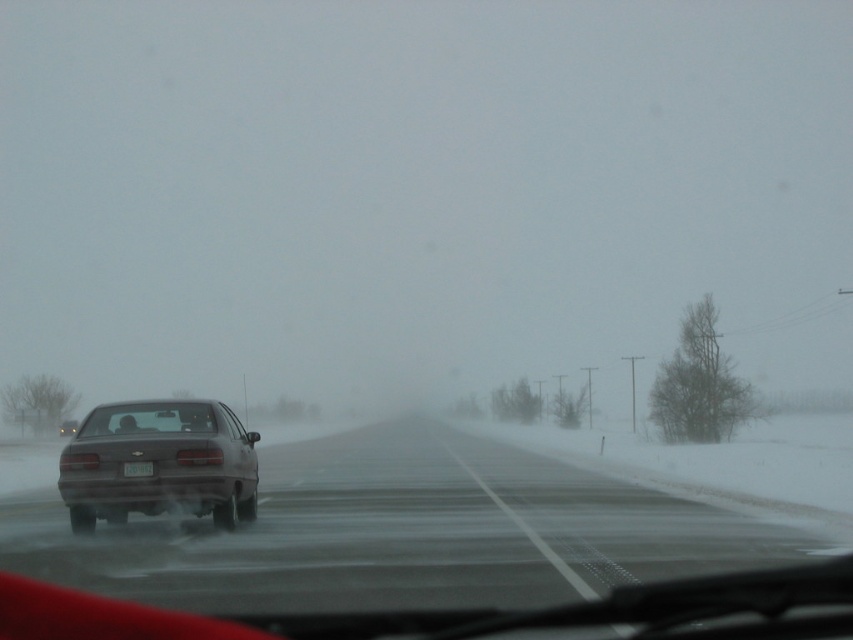
Is smokey asphalt highway at center taller than white plastic license plate at center?

Indeed, smokey asphalt highway at center has a greater height compared to white plastic license plate at center.

Can you confirm if smokey asphalt highway at center is positioned below white plastic license plate at center?

Yes.

You are a GUI agent. You are given a task and a screenshot of the screen. Output one action in this format:
    pyautogui.click(x=<x>, y=<y>)
    Task: Click on the smokey asphalt highway at center
    The image size is (853, 640).
    Given the screenshot: What is the action you would take?
    tap(402, 532)

Does transparent glass windshield at center have a greater height compared to white plastic license plate at center?

Correct, transparent glass windshield at center is much taller as white plastic license plate at center.

Between transparent glass windshield at center and white plastic license plate at center, which one is positioned higher?

Positioned higher is transparent glass windshield at center.

This screenshot has width=853, height=640. Identify the location of transparent glass windshield at center. (149, 419).

Does matte gray sedan at center appear on the right side of transparent glass windshield at center?

Yes, matte gray sedan at center is to the right of transparent glass windshield at center.

Is matte gray sedan at center behind transparent glass windshield at center?

No, matte gray sedan at center is closer to the viewer.

Is point (152, 480) closer to camera compared to point (172, 429)?

Yes, point (152, 480) is closer to viewer.

Locate an element on the screen. Image resolution: width=853 pixels, height=640 pixels. matte gray sedan at center is located at coordinates (160, 464).